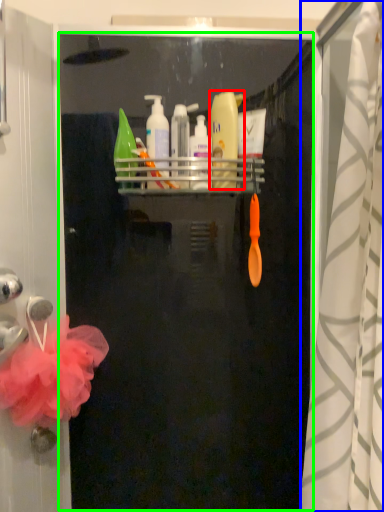
Question: Which object is the closest to the cleaning product (highlighted by a red box)? Choose among these: shower curtain (highlighted by a blue box) or screen door (highlighted by a green box).

Choices:
 (A) shower curtain
 (B) screen door

Answer: (B)